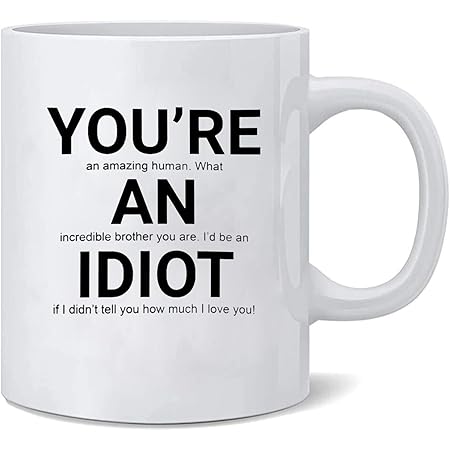
Locate an element on the screen. This screenshot has height=450, width=450. handle is located at coordinates (353, 295).